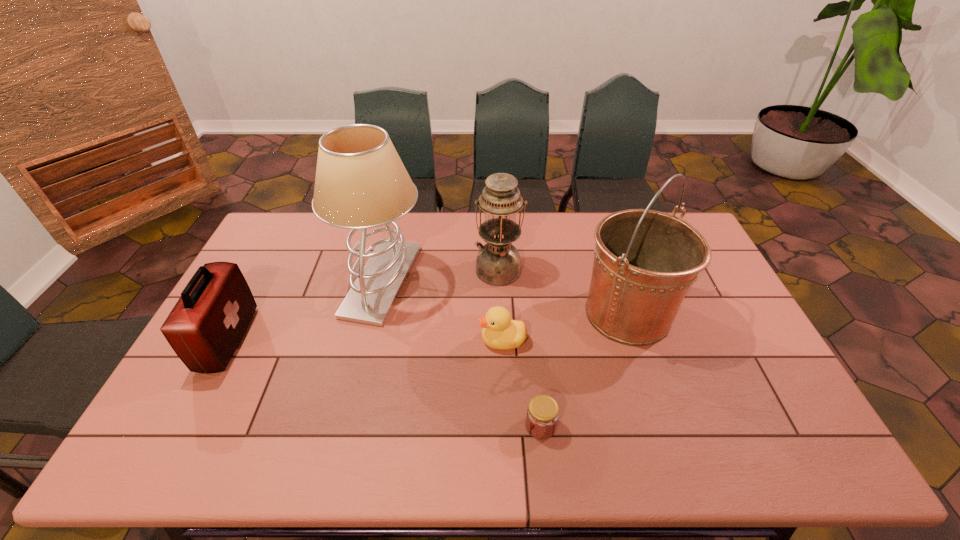
I want to click on free space that is in between the first aid kit and the second shortest object, so click(365, 340).

Where is `free spot between the fourth tallest object and the second object from left to right`? The width and height of the screenshot is (960, 540). free spot between the fourth tallest object and the second object from left to right is located at coordinates (305, 310).

You are a GUI agent. You are given a task and a screenshot of the screen. Output one action in this format:
    pyautogui.click(x=<x>, y=<y>)
    Task: Click on the vacant point located between the second object from left to right and the first aid kit
    Image resolution: width=960 pixels, height=540 pixels.
    Given the screenshot: What is the action you would take?
    pyautogui.click(x=305, y=310)

You are a GUI agent. You are given a task and a screenshot of the screen. Output one action in this format:
    pyautogui.click(x=<x>, y=<y>)
    Task: Click on the vacant area that lies between the bucket and the fifth object from right to left
    The image size is (960, 540).
    Given the screenshot: What is the action you would take?
    pyautogui.click(x=505, y=297)

Choose which object is the second nearest neighbor to the nearest object. Please provide its 2D coordinates. Your answer should be formatted as a tuple, i.e. [(x, y)], where the tuple contains the x and y coordinates of a point satisfying the conditions above.

[(645, 261)]

Find the location of a particular element. This screenshot has width=960, height=540. object identified as the closest to the shortest object is located at coordinates (500, 332).

Locate an element on the screen. The image size is (960, 540). vacant space that satisfies the following two spatial constraints: 1. on the back side of the shortest object; 2. at the beak of the duck is located at coordinates pos(531,340).

Where is `free space that satisfies the following two spatial constraints: 1. on the front side of the table lamp; 2. on the left side of the rightmost object`? The image size is (960, 540). free space that satisfies the following two spatial constraints: 1. on the front side of the table lamp; 2. on the left side of the rightmost object is located at coordinates (374, 313).

The width and height of the screenshot is (960, 540). Identify the location of vacant region that satisfies the following two spatial constraints: 1. at the beak of the second shortest object; 2. on the back side of the nearest object. (506, 426).

Identify the location of free space that satisfies the following two spatial constraints: 1. on the back side of the bucket; 2. on the right side of the jam. (528, 313).